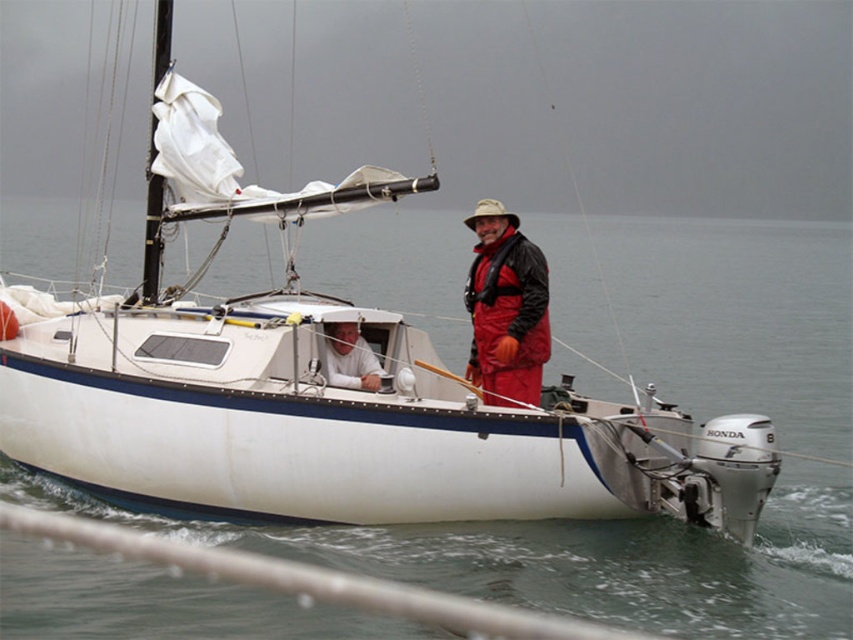
Between red waterproof suit at center and white matte shirt at center, which one appears on the right side from the viewer's perspective?

From the viewer's perspective, red waterproof suit at center appears more on the right side.

Looking at this image, which of these two, red waterproof suit at center or white matte shirt at center, stands shorter?

Standing shorter between the two is white matte shirt at center.

Is point (473, 330) positioned after point (326, 376)?

Yes, point (473, 330) is farther from viewer.

At what (x,y) coordinates should I click in order to perform the action: click on red waterproof suit at center. Please return your answer as a coordinate pair (x, y). The width and height of the screenshot is (853, 640). Looking at the image, I should click on (506, 308).

Who is more distant from viewer, (151, 161) or (338, 342)?

Point (151, 161)

Is point (158, 266) positioned in front of point (329, 326)?

No, it is behind (329, 326).

Image resolution: width=853 pixels, height=640 pixels. In order to click on white sail at upper left in this screenshot , I will do `click(152, 227)`.

Is clear water at boat center wider than white matte shirt at center?

Indeed, clear water at boat center has a greater width compared to white matte shirt at center.

Between point (479, 556) and point (361, 365), which one is positioned in front?

Point (479, 556)

You are a GUI agent. You are given a task and a screenshot of the screen. Output one action in this format:
    pyautogui.click(x=<x>, y=<y>)
    Task: Click on the clear water at boat center
    Image resolution: width=853 pixels, height=640 pixels.
    Given the screenshot: What is the action you would take?
    pyautogui.click(x=590, y=560)